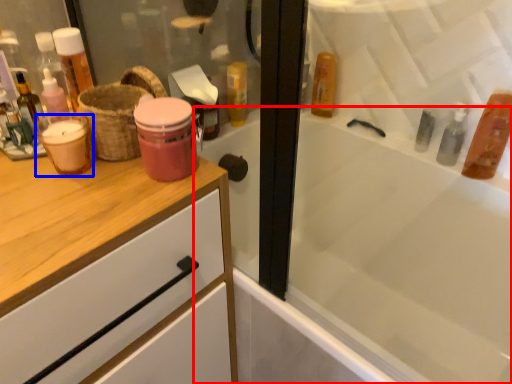
Question: Which of the following is the farthest to the observer, bathtub (highlighted by a red box) or mouthwash (highlighted by a blue box)?

Choices:
 (A) bathtub
 (B) mouthwash

Answer: (B)